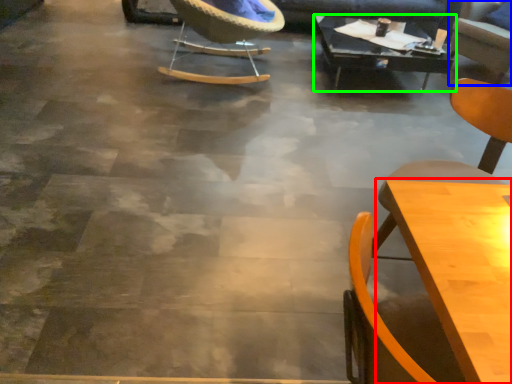
Question: Estimate the real-world distances between objects in this image. Which object is closer to table (highlighted by a red box), chair (highlighted by a blue box) or table (highlighted by a green box)?

Choices:
 (A) chair
 (B) table

Answer: (B)